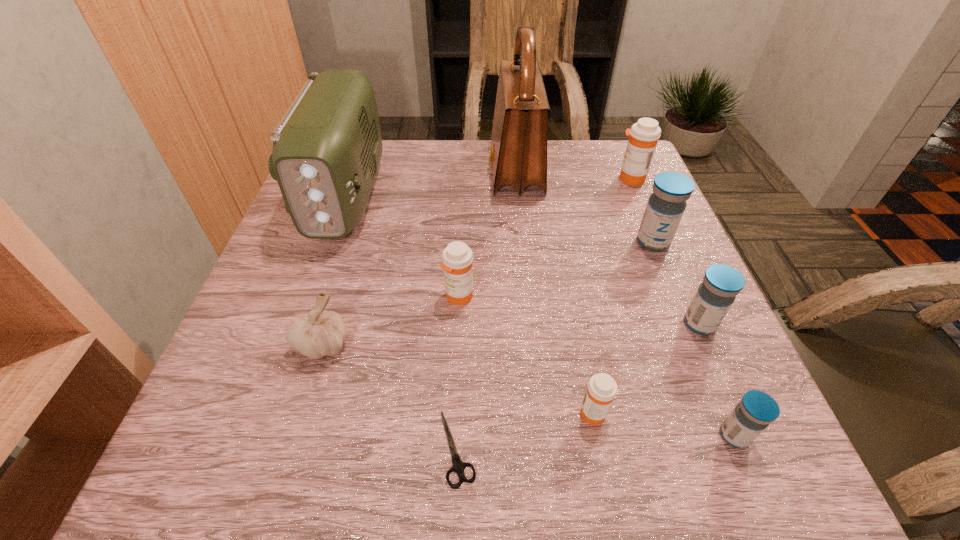
Identify the location of medicine at the far edge. The height and width of the screenshot is (540, 960). (644, 134).

Where is `medicine that is at the near edge`? Image resolution: width=960 pixels, height=540 pixels. medicine that is at the near edge is located at coordinates (756, 410).

Find the location of a particular element. This screenshot has width=960, height=540. shears that is at the near edge is located at coordinates (459, 466).

Identify the location of radio_receiver at the left edge. This screenshot has height=540, width=960. (327, 147).

Locate an element on the screen. The height and width of the screenshot is (540, 960). garlic that is at the left edge is located at coordinates (323, 332).

What are the coordinates of `object at the far left corner` in the screenshot? It's located at (327, 147).

At what (x,y) coordinates should I click in order to perform the action: click on object positioned at the far right corner. Please return your answer as a coordinate pair (x, y). The width and height of the screenshot is (960, 540). Looking at the image, I should click on (644, 134).

The height and width of the screenshot is (540, 960). I want to click on object that is at the near right corner, so click(756, 410).

Where is `vacant space at the far edge of the desktop`? vacant space at the far edge of the desktop is located at coordinates (471, 170).

This screenshot has width=960, height=540. I want to click on vacant space at the left edge of the desktop, so click(301, 284).